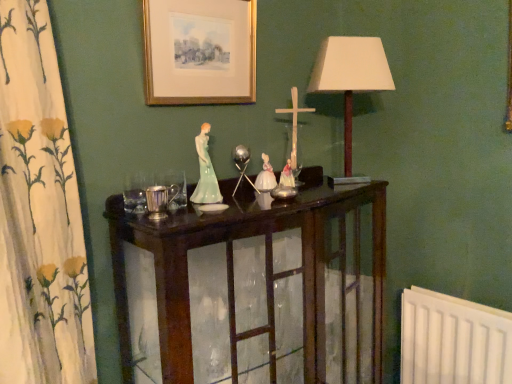
Find the location of a particular element. The width and height of the screenshot is (512, 384). vacant point to the right of silver metallic candle holder at center is located at coordinates (204, 215).